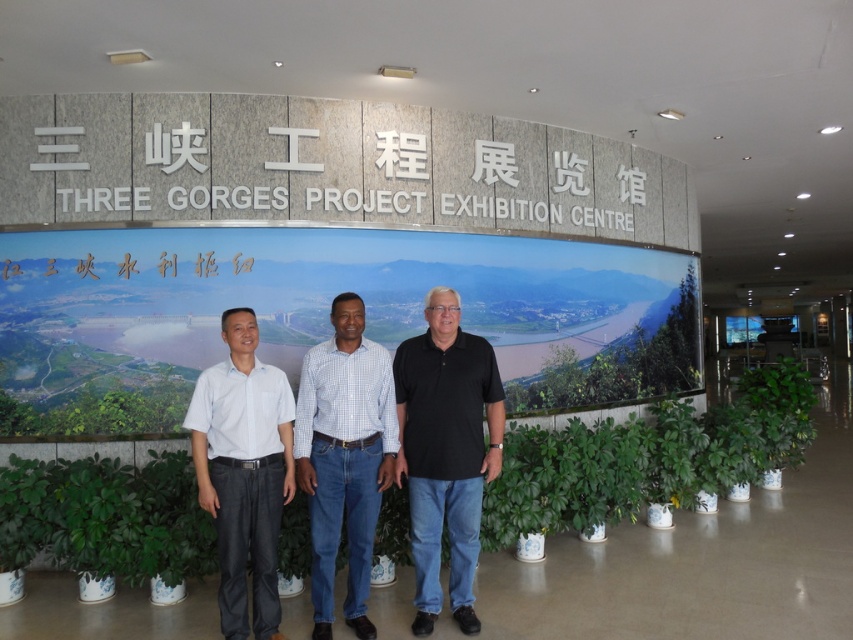
You are standing in front of the Three Gorges Project Exhibition Centre display board. You see two people wearing a black cotton polo shirt at center and a checkered fabric shirt at center. Which person is standing in front of the other?

The black cotton polo shirt at center is above the checkered fabric shirt at center, so the person wearing the black cotton polo shirt at center is standing in front of the person wearing the checkered fabric shirt at center.